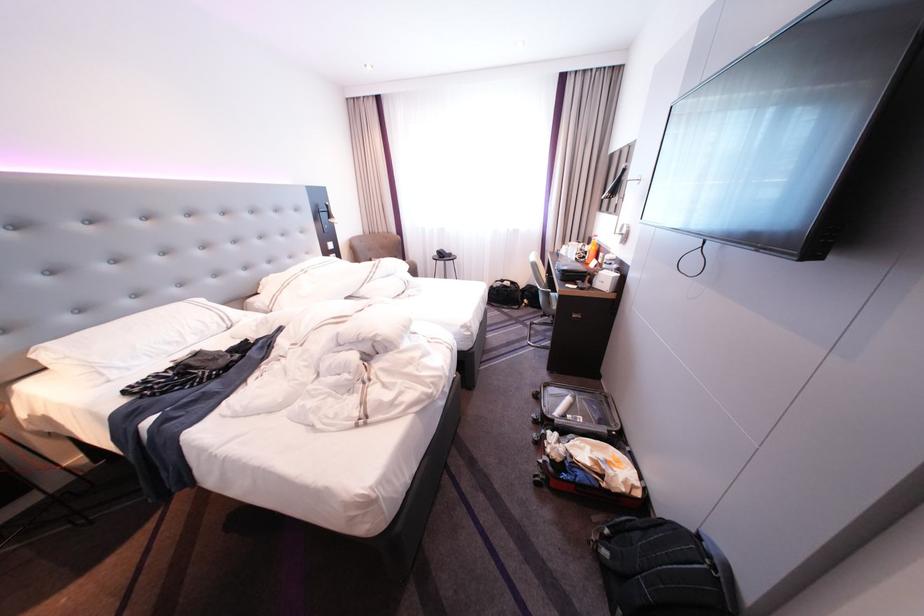
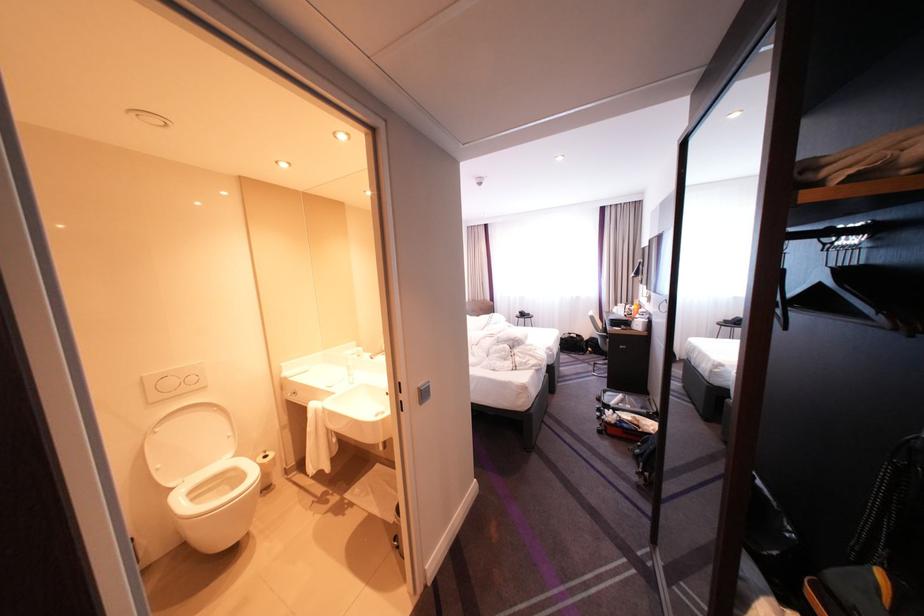
The point at (533,286) is marked in the first image. Where is the corresponding point in the second image?

(599, 338)